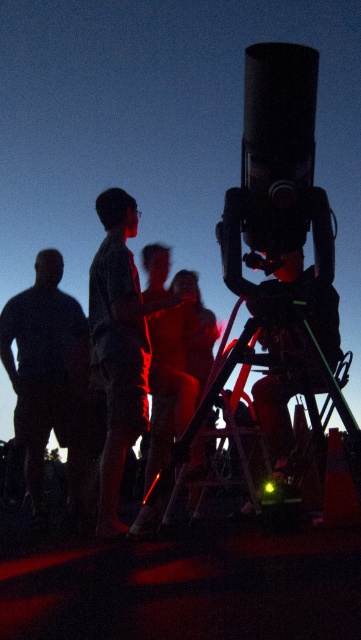
You are standing in the observatory and see the plaid shirt at center and the metallic tripod at center. Which object is taller?

The plaid shirt at center is taller than the metallic tripod at center.

You are a photographer trying to capture a group photo of the dark blue shirt at left and the metallic tripod at center. If you want to ensure both subjects are in focus, which one should you focus on first based on their positions?

The dark blue shirt at left has a greater height compared to the metallic tripod at center, so you should focus on the dark blue shirt at left first to ensure both are in focus.

You are standing in the observatory and want to adjust the telescope. To do this, you need to move around the dark blue shirt at left and the metallic tripod at center. Which object should you move around first to reach the telescope?

You should move around the dark blue shirt at left first because the metallic tripod at center is behind it, so the dark blue shirt at left is closer to you.